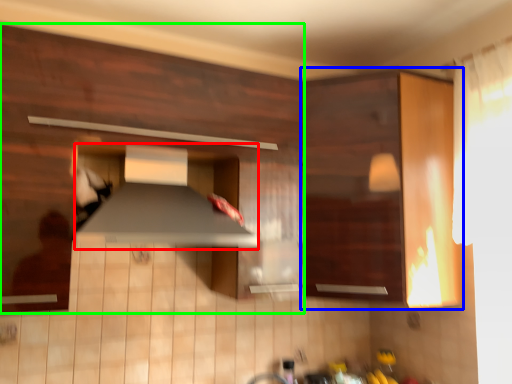
Question: Based on their relative distances, which object is farther from exhaust hood (highlighted by a red box)? Choose from cabinetry (highlighted by a blue box) and cabinetry (highlighted by a green box).

Choices:
 (A) cabinetry
 (B) cabinetry

Answer: (A)